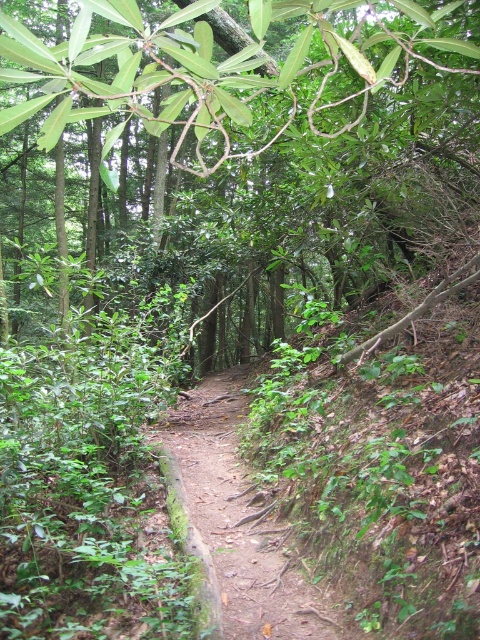
Which of these two, green leafy tree at center or dirt path at center, stands taller?

green leafy tree at center is taller.

Between green leafy tree at center and dirt path at center, which one is positioned lower?

Positioned lower is dirt path at center.

What do you see at coordinates (274, 129) in the screenshot?
I see `green leafy tree at center` at bounding box center [274, 129].

Identify the location of green leafy tree at center. The image size is (480, 640). (274, 129).